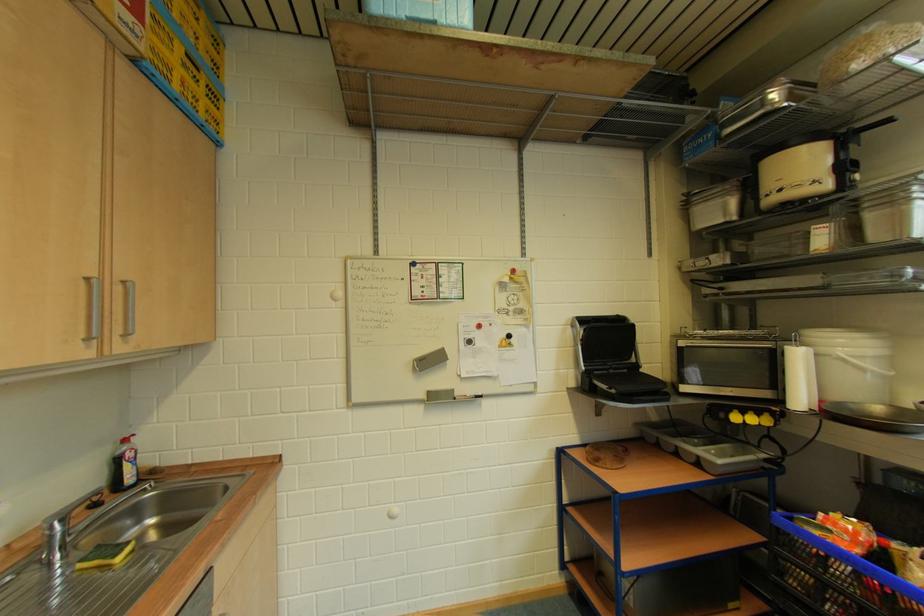
At what (x,y) coordinates should I click in order to perform the action: click on paper towel roll. Please return your answer as a coordinate pair (x, y). The width and height of the screenshot is (924, 616). Looking at the image, I should click on coord(799,379).